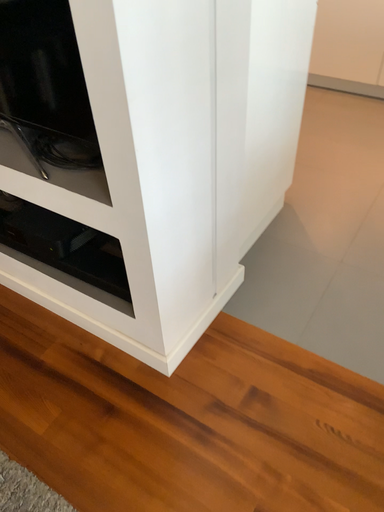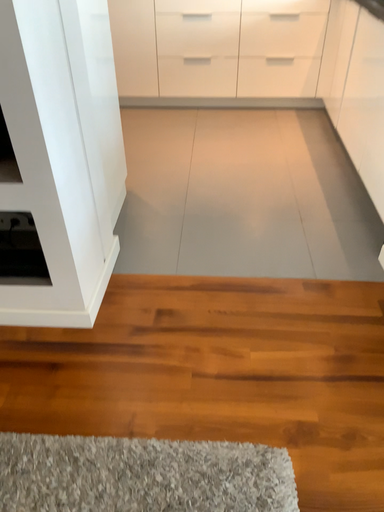
Question: Which way did the camera rotate in the video?

Choices:
 (A) rotated downward
 (B) rotated upward

Answer: (B)